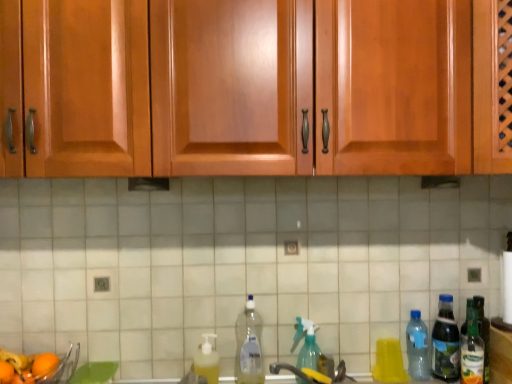
Question: Does clear plastic bottle at center, the sixth bottle from the right, have a lesser height compared to orange matte at lower left, marked as the first orange in a back-to-front arrangement?

Choices:
 (A) yes
 (B) no

Answer: (B)

Question: Is clear plastic bottle at center, the sixth bottle from the right, bigger than orange matte at lower left, marked as the first orange in a back-to-front arrangement?

Choices:
 (A) no
 (B) yes

Answer: (B)

Question: Does clear plastic bottle at center, the sixth bottle from the right, appear on the right side of orange matte at lower left, the first orange when ordered from right to left?

Choices:
 (A) yes
 (B) no

Answer: (A)

Question: From a real-world perspective, does clear plastic bottle at center, the sixth bottle from the right, stand above orange matte at lower left, marked as the first orange in a back-to-front arrangement?

Choices:
 (A) yes
 (B) no

Answer: (A)

Question: From the image's perspective, does clear plastic bottle at center, the 2th bottle when ordered from left to right, appear lower than orange matte at lower left, the 2th orange in the left-to-right sequence?

Choices:
 (A) no
 (B) yes

Answer: (A)

Question: Do you think black matte exhaust hood at center is within clear plastic bottle at right, which is counted as the fifth bottle, starting from the left, or outside of it?

Choices:
 (A) inside
 (B) outside

Answer: (B)

Question: In the image, is black matte exhaust hood at center on the left side or the right side of clear plastic bottle at right, which is counted as the fifth bottle, starting from the left?

Choices:
 (A) right
 (B) left

Answer: (B)

Question: From the image's perspective, relative to clear plastic bottle at right, which is counted as the fifth bottle, starting from the left, is black matte exhaust hood at center above or below?

Choices:
 (A) above
 (B) below

Answer: (A)

Question: Considering the positions of point (157, 185) and point (426, 347), is point (157, 185) closer or farther from the camera than point (426, 347)?

Choices:
 (A) closer
 (B) farther

Answer: (A)

Question: Is translucent plastic bottle at right, acting as the 6th bottle starting from the left, wider or thinner than clear plastic bottle at right, arranged as the 3th bottle when viewed from the right?

Choices:
 (A) wide
 (B) thin

Answer: (A)

Question: In the image, is translucent plastic bottle at right, acting as the 6th bottle starting from the left, positioned in front of or behind clear plastic bottle at right, arranged as the 3th bottle when viewed from the right?

Choices:
 (A) behind
 (B) front

Answer: (B)

Question: Considering the positions of point (450, 301) and point (412, 370), is point (450, 301) closer or farther from the camera than point (412, 370)?

Choices:
 (A) closer
 (B) farther

Answer: (B)

Question: Based on their sizes in the image, would you say translucent plastic bottle at right, acting as the 6th bottle starting from the left, is bigger or smaller than clear plastic bottle at right, arranged as the 3th bottle when viewed from the right?

Choices:
 (A) small
 (B) big

Answer: (B)

Question: From a real-world perspective, is clear plastic bottle at center, the sixth bottle from the right, positioned above or below clear plastic bottle at right, which is counted as the fifth bottle, starting from the left?

Choices:
 (A) above
 (B) below

Answer: (A)

Question: Is point (254, 312) positioned closer to the camera than point (418, 365)?

Choices:
 (A) closer
 (B) farther

Answer: (A)